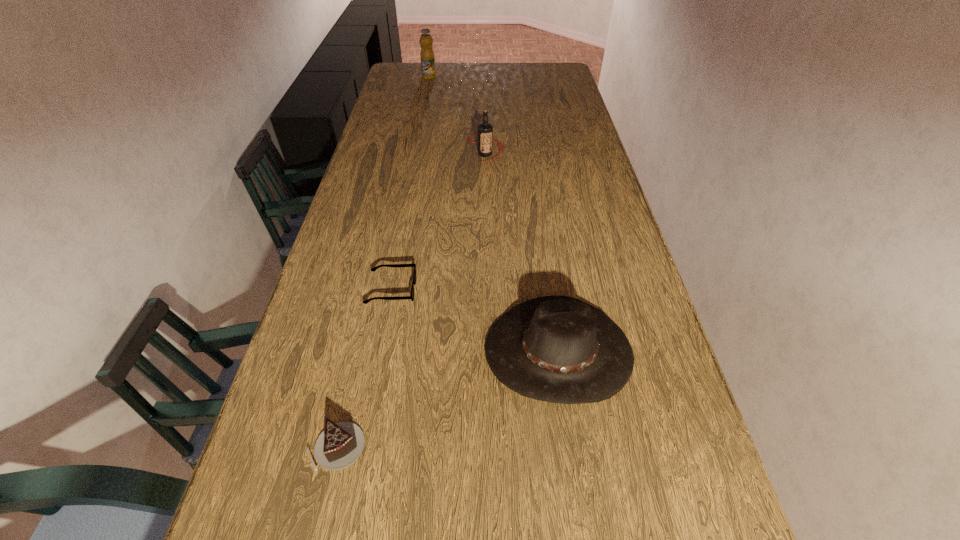
The width and height of the screenshot is (960, 540). Find the location of `vacant region between the farthest object and the shortest object`. vacant region between the farthest object and the shortest object is located at coordinates (410, 184).

Where is `free spot between the fourth tallest object and the second tallest object`? Image resolution: width=960 pixels, height=540 pixels. free spot between the fourth tallest object and the second tallest object is located at coordinates (411, 300).

The width and height of the screenshot is (960, 540). Find the location of `object identified as the second closest to the nearest object`. object identified as the second closest to the nearest object is located at coordinates (411, 296).

I want to click on object identified as the third closest to the shortest object, so click(x=485, y=130).

Identify the location of blank space that satisfies the following two spatial constraints: 1. on the label of the second farthest object; 2. on the arms of the spectacles. (488, 291).